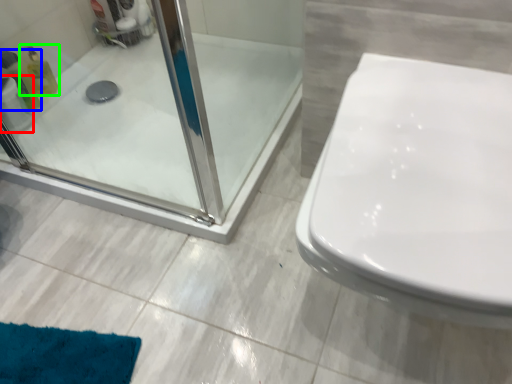
Question: Based on their relative distances, which object is nearer to toilet paper (highlighted by a red box)? Choose from cleaning product (highlighted by a blue box) and cleaning product (highlighted by a green box).

Choices:
 (A) cleaning product
 (B) cleaning product

Answer: (A)